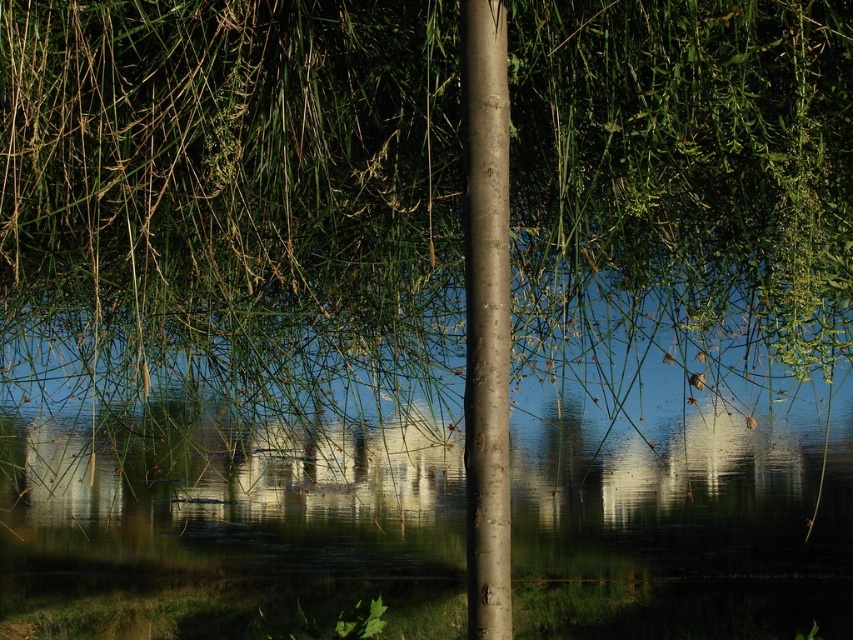
You are a photographer planning to capture the reflection of the smooth brown pole at center in the clear water at center. Based on the scene description, can you confirm if the entire pole will fit within the water surface area for a perfect reflection?

The clear water at center has a larger width than the smooth brown pole at center, so the entire pole will fit within the water surface area for a perfect reflection.

You are a photographer aiming to capture the reflection of the smooth brown pole at center in the clear water at center. Based on the scene description, can you confirm if the reflection will be fully visible in the water?

The clear water at center has a larger size compared to smooth brown pole at center, so the reflection of the smooth brown pole at center should be fully visible within the clear water at center since the water area is bigger than the pole.

You are standing in the scene and want to cross from the left to the right side. The smooth brown pole at center is blocking your path. Can you go around it by stepping on the clear water at center?

The clear water at center is below the smooth brown pole at center, so you can step on the clear water at center to go around the pole as it is located beneath it.